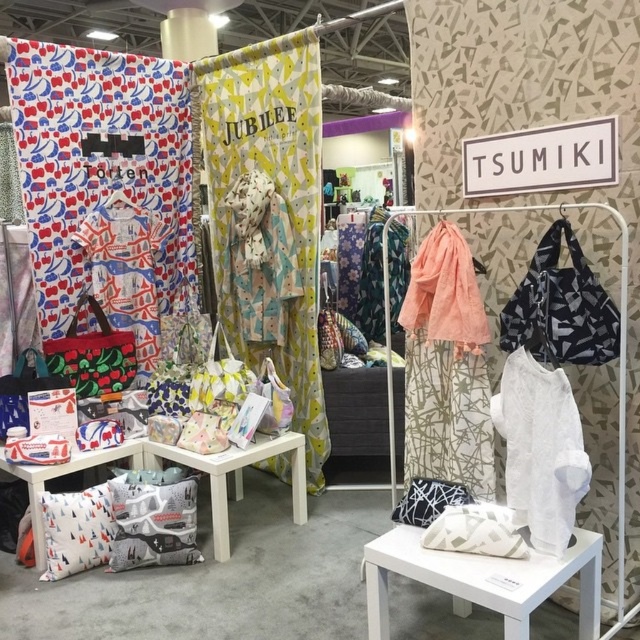
You are standing at the entrance of the retail display and want to touch both the white fabric stool at center and the patterned fabric dress at center. Which object will you reach first?

The white fabric stool at center is closer to the viewer than the patterned fabric dress at center, so you will reach the white fabric stool at center first.

Looking at this image, you are a fashion designer observing the retail display. There are two dresses at the center of the display. Which one do you think is wider, the printed fabric dress at center or the patterned fabric dress at center?

The printed fabric dress at center might be wider than the patterned fabric dress at center.

You are a visitor at the exhibition and want to place a 2 meter long banner between the white fabric stool at center and the matte fabric bag at left. Is there enough space between them to place the banner horizontally?

The white fabric stool at center and the matte fabric bag at left are 2.13 meters apart from each other, so yes, the 2 meter long banner can be placed horizontally between them as the distance is sufficient.